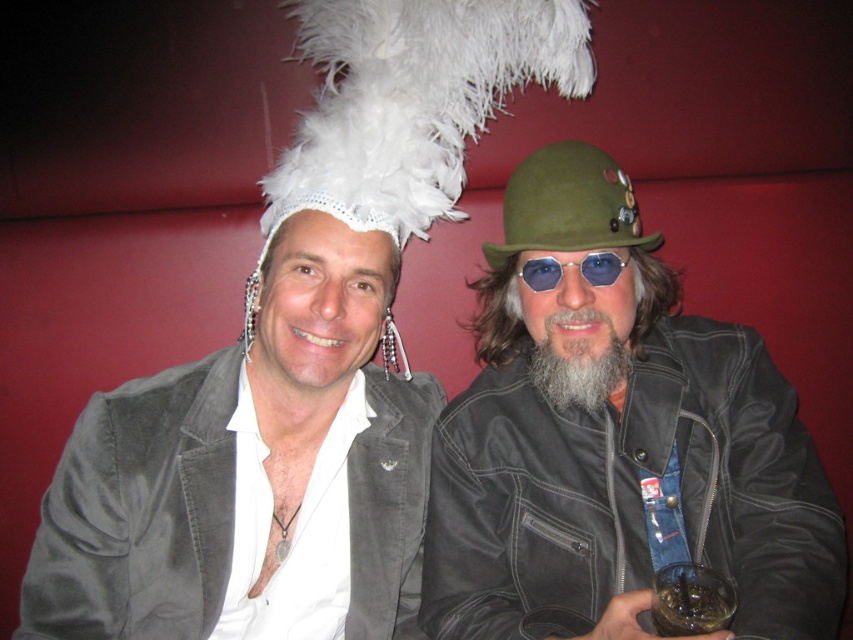
Question: Among these objects, which one is nearest to the camera?

Choices:
 (A) translucent glass beverage at lower right
 (B) leather jacket at center

Answer: (A)

Question: Which object is positioned farthest from the graywoollybeard at center?

Choices:
 (A) blue reflective lenses at center
 (B) suede jacket at center
 (C) translucent glass beverage at lower right
 (D) olive green felt hat at center

Answer: (B)

Question: Estimate the real-world distances between objects in this image. Which object is closer to the translucent glass beverage at lower right?

Choices:
 (A) graywoollybeard at center
 (B) leather jacket at center

Answer: (B)

Question: Where is suede jacket at center located in relation to blue reflective lenses at center in the image?

Choices:
 (A) below
 (B) above

Answer: (A)

Question: From the image, what is the correct spatial relationship of suede jacket at center in relation to olive green felt hat at center?

Choices:
 (A) below
 (B) above

Answer: (A)

Question: Can you confirm if suede jacket at center is smaller than translucent glass beverage at lower right?

Choices:
 (A) yes
 (B) no

Answer: (B)